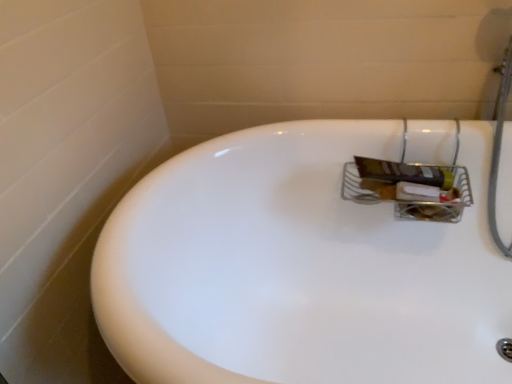
Locate an element on the screen. The image size is (512, 384). white glossy bathtub at upper right is located at coordinates (298, 268).

This screenshot has height=384, width=512. Describe the element at coordinates (298, 268) in the screenshot. I see `white glossy bathtub at upper right` at that location.

Identify the location of white glossy bathtub at upper right. (298, 268).